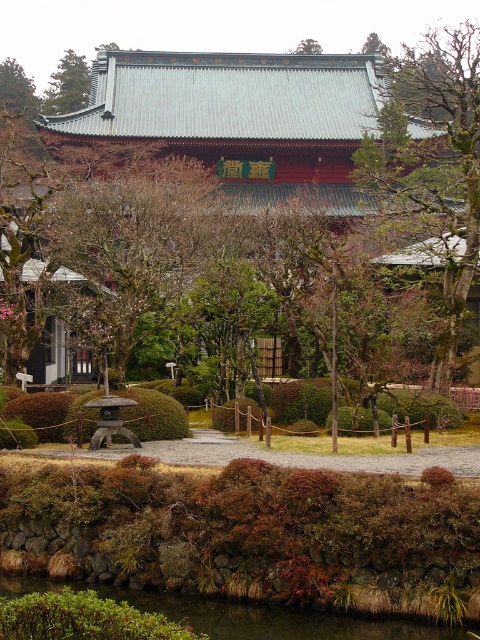
Between green grassy water at lower left and green leafy tree at upper left, which one appears on the right side from the viewer's perspective?

Positioned to the right is green grassy water at lower left.

Who is more distant from viewer, (286, 634) or (81, 88)?

Positioned behind is point (81, 88).

Which is behind, point (273, 636) or point (72, 70)?

The point (72, 70) is more distant.

This screenshot has height=640, width=480. I want to click on green grassy water at lower left, so click(x=249, y=616).

Is green grassy water at lower left further to camera compared to brown wood tree at upper left?

No, green grassy water at lower left is closer to the viewer.

Between point (387, 632) and point (31, 115), which one is positioned behind?

Point (31, 115)

What are the coordinates of `green grassy water at lower left` in the screenshot? It's located at (249, 616).

What do you see at coordinates (432, 163) in the screenshot?
I see `bare branches at upper right` at bounding box center [432, 163].

Image resolution: width=480 pixels, height=640 pixels. What are the coordinates of `bare branches at upper right` in the screenshot? It's located at (432, 163).

Between point (429, 212) and point (226, 614), which one is positioned behind?

Positioned behind is point (429, 212).

Image resolution: width=480 pixels, height=640 pixels. What are the coordinates of `bare branches at upper right` in the screenshot? It's located at (432, 163).